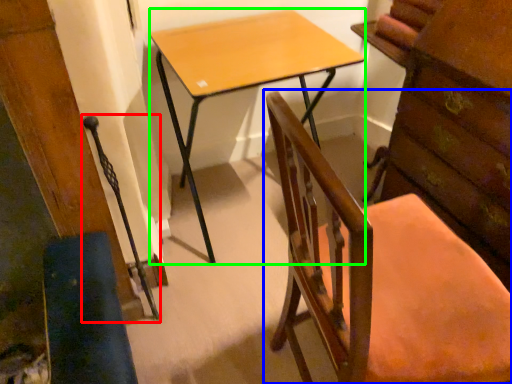
Question: Which is nearer to the swivel chair (highlighted by a red box)? chair (highlighted by a blue box) or desk (highlighted by a green box).

Choices:
 (A) chair
 (B) desk

Answer: (B)